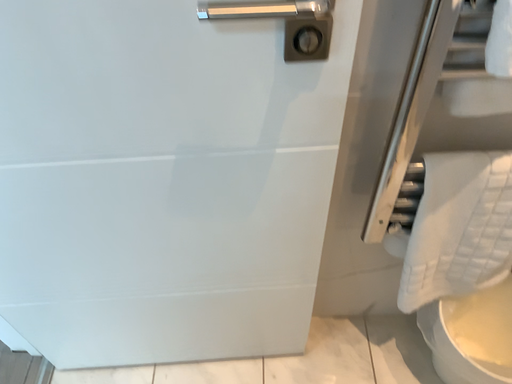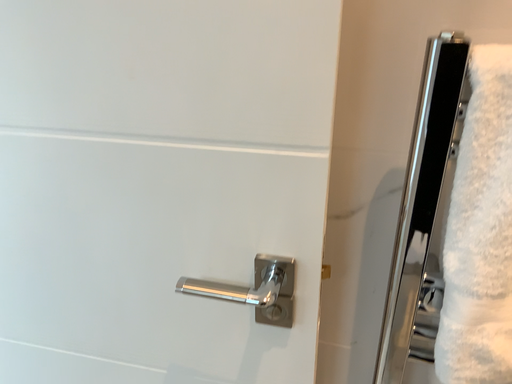
Question: How did the camera likely rotate when shooting the video?

Choices:
 (A) rotated left
 (B) rotated right

Answer: (A)